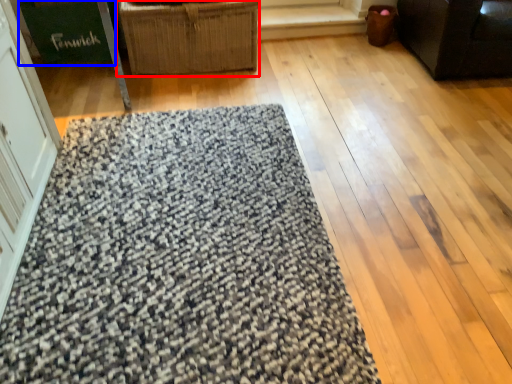
Question: Which point is further to the camera, furniture (highlighted by a red box) or cardboard box (highlighted by a blue box)?

Choices:
 (A) furniture
 (B) cardboard box

Answer: (B)